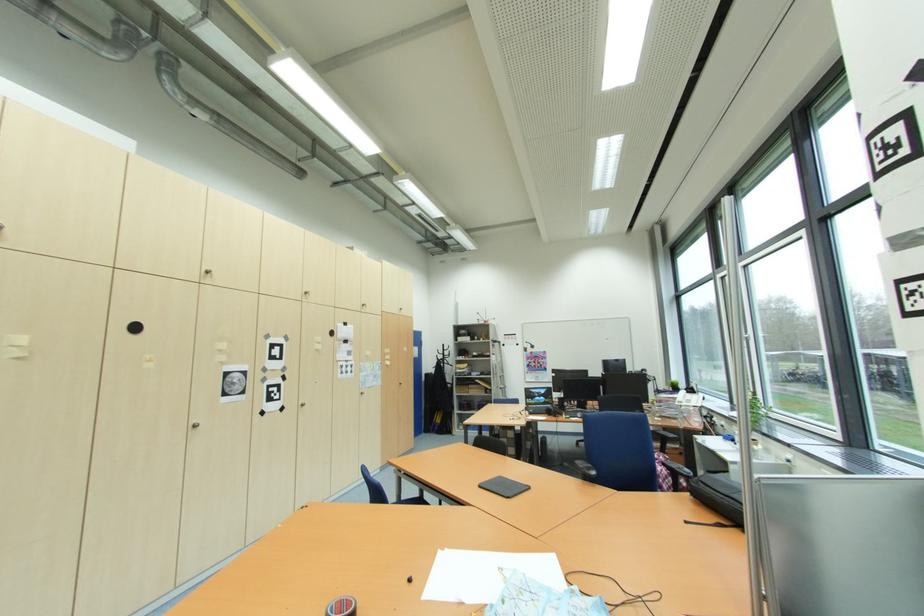
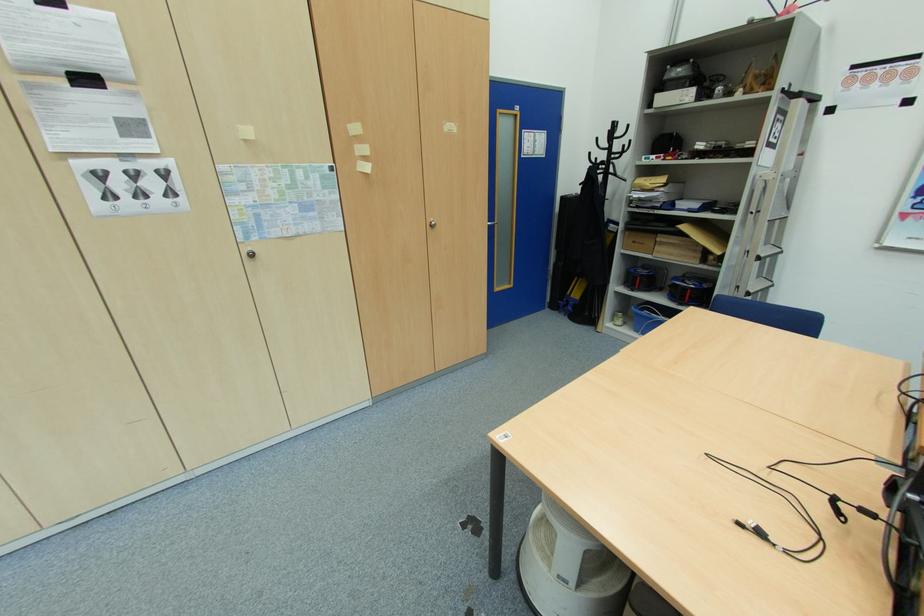
Locate, in the second image, the point that corresponds to the point at 448,350 in the first image.

(619, 136)